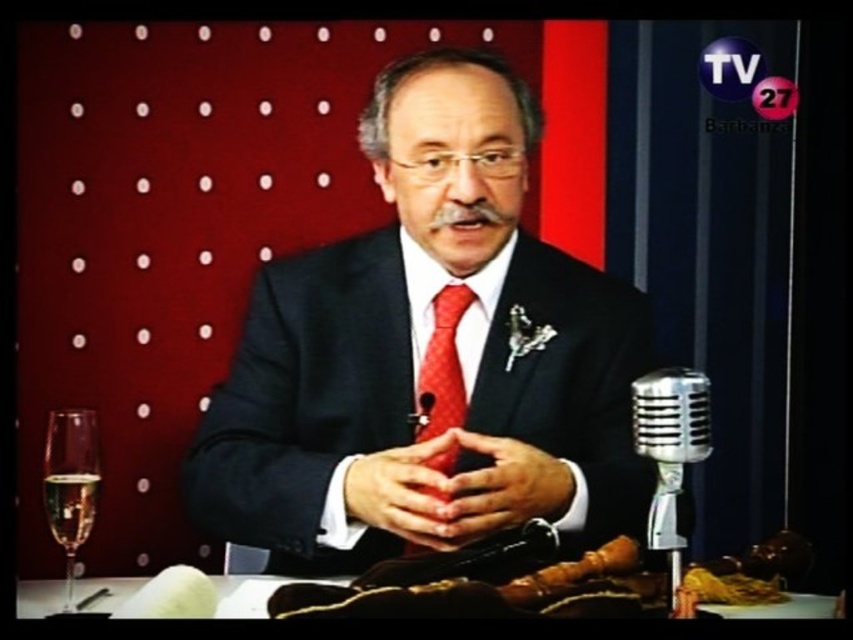
You are a camera operator adjusting the camera angle to focus on the matte black suit at center and the clear glass champagne flute at lower left. Based on their positions, which object should you pan the camera towards first to ensure both are in frame?

The clear glass champagne flute at lower left should be panned to first since the matte black suit at center is above it, meaning the flute is lower in the frame and requires adjusting the camera angle downward to include both objects.

You are a guest on a talk show and you see a matte red heart at center and a clear glass wine glass at lower left on the desk. Which object is closer to you?

The matte red heart at center is closer to you because it is located above the clear glass wine glass at lower left, which is further away.